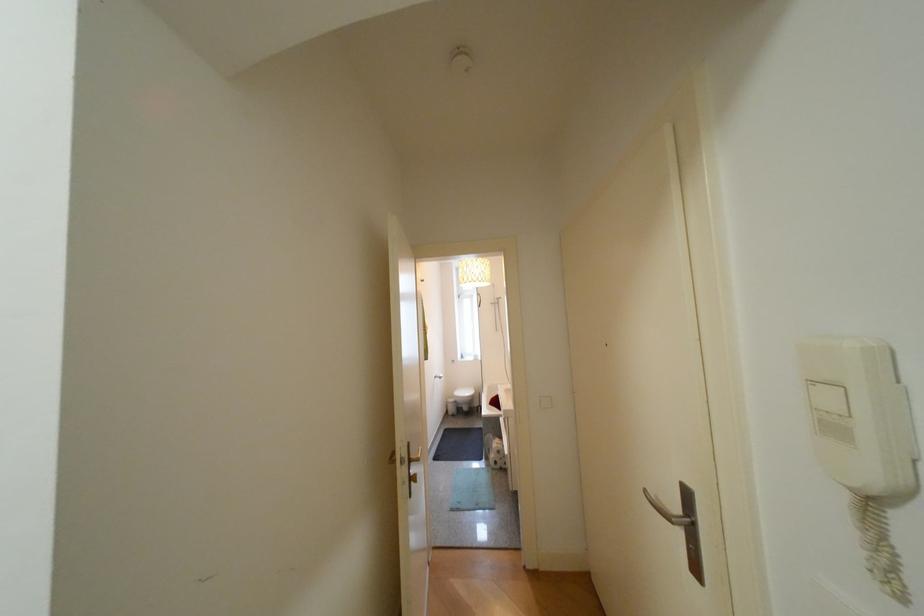
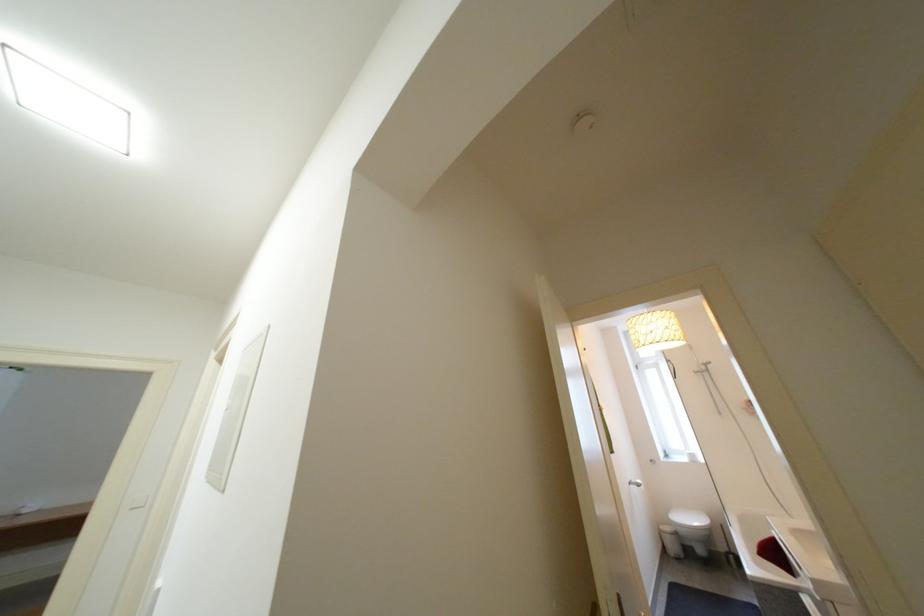
First-person continuous shooting, in which direction is the camera rotating?

The camera rotated toward left-up.